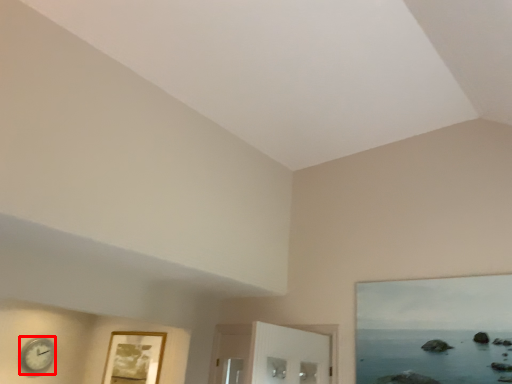
Question: In this image, where is clock (annotated by the red box) located relative to picture frame?

Choices:
 (A) left
 (B) right

Answer: (A)